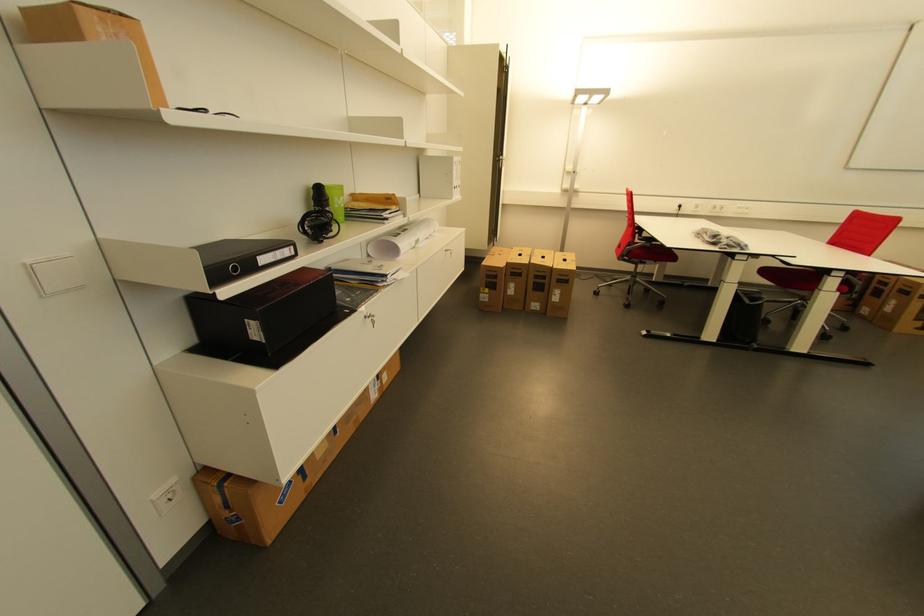
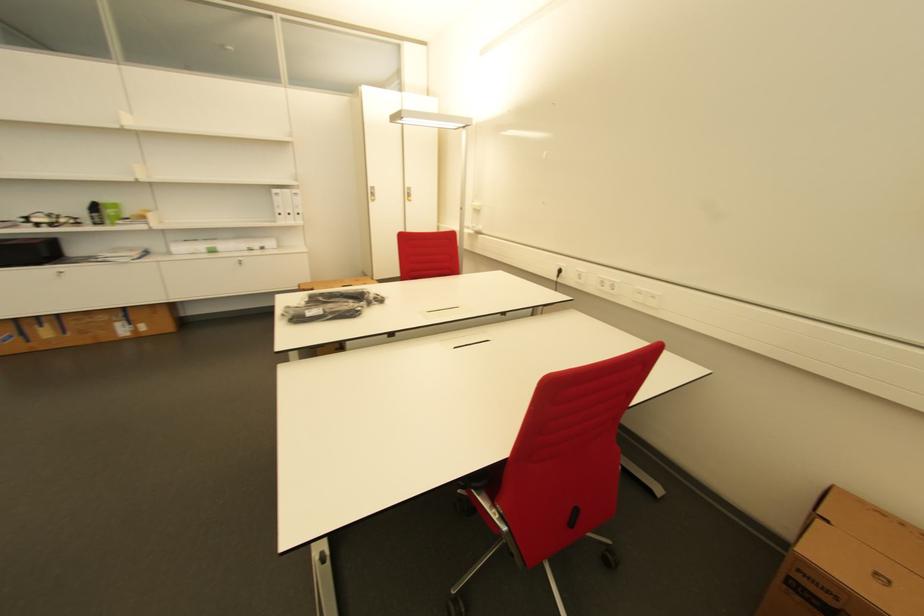
The point at [752,209] is marked in the first image. Where is the corresponding point in the second image?

(659, 299)